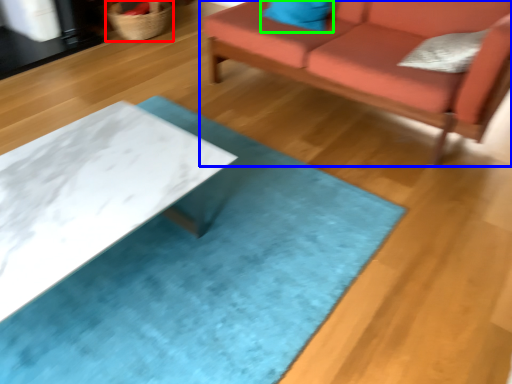
Question: Based on their relative distances, which object is farther from basket (highlighted by a red box)? Choose from studio couch (highlighted by a blue box) and pillow (highlighted by a green box).

Choices:
 (A) studio couch
 (B) pillow

Answer: (A)